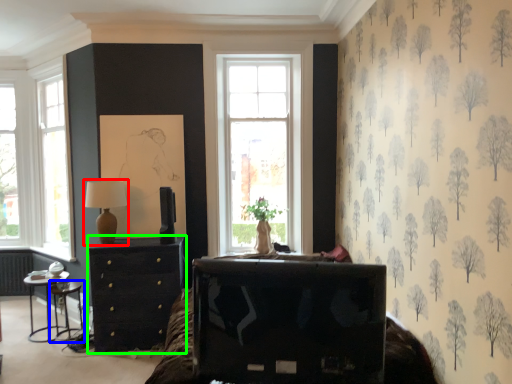
Question: Which is farther away from table lamp (highlighted by a red box)? side table (highlighted by a blue box) or chest of drawers (highlighted by a green box)?

Choices:
 (A) side table
 (B) chest of drawers

Answer: (A)